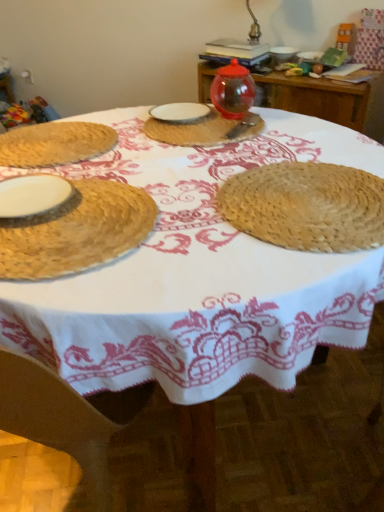
The width and height of the screenshot is (384, 512). Find the location of `free space to the left of matte wicker placemat at center`. free space to the left of matte wicker placemat at center is located at coordinates (102, 135).